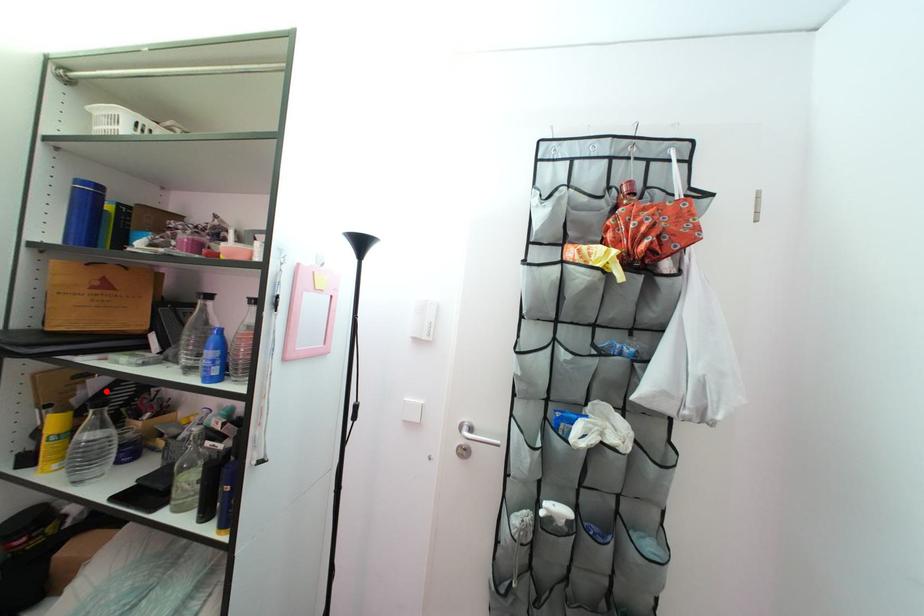
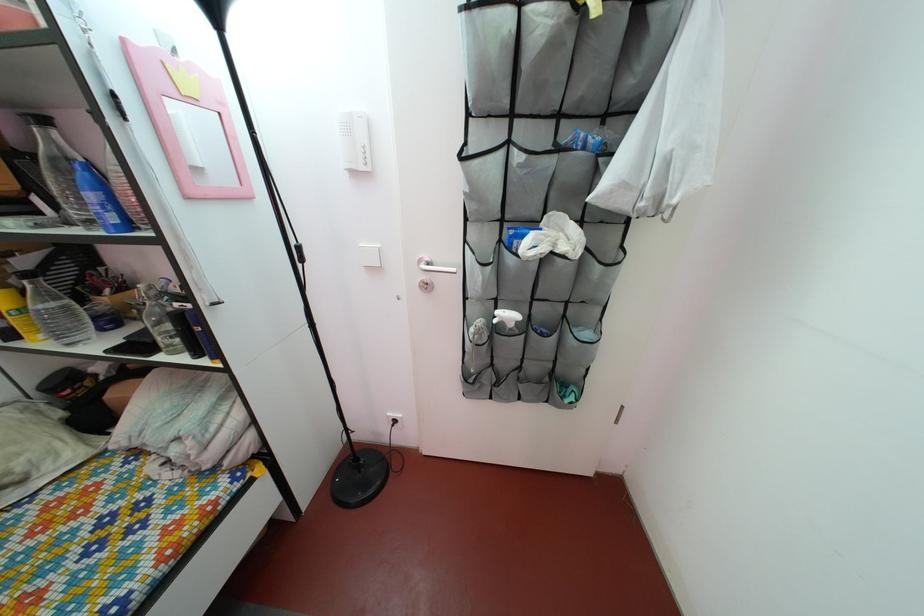
Locate, in the second image, the point that corresponds to the highlighted location in the first image.

(32, 270)